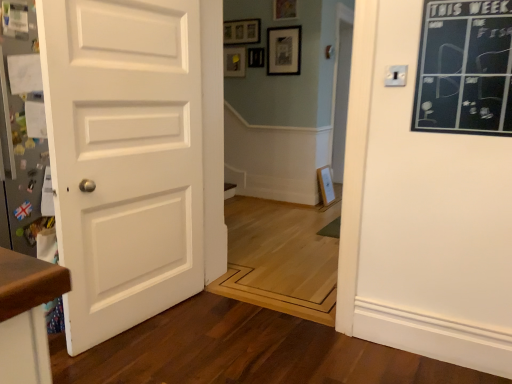
Question: In which direction should I rotate to look at matte black picture frame at upper center, which appears as the third picture frame when viewed from the top?

Choices:
 (A) right
 (B) left

Answer: (B)

Question: Is wooden picture frame at upper center, which is the 3th picture frame from bottom to top, to the right of white matte door at left from the viewer's perspective?

Choices:
 (A) yes
 (B) no

Answer: (A)

Question: From the image's perspective, is wooden picture frame at upper center, placed as the first picture frame when sorted from top to bottom, below white matte door at left?

Choices:
 (A) no
 (B) yes

Answer: (A)

Question: Is wooden picture frame at upper center, placed as the first picture frame when sorted from top to bottom, shorter than white matte door at left?

Choices:
 (A) no
 (B) yes

Answer: (B)

Question: Is wooden picture frame at upper center, placed as the first picture frame when sorted from top to bottom, next to white matte door at left and touching it?

Choices:
 (A) no
 (B) yes

Answer: (A)

Question: Is wooden picture frame at upper center, placed as the first picture frame when sorted from top to bottom, wider than white matte door at left?

Choices:
 (A) no
 (B) yes

Answer: (A)

Question: From a real-world perspective, does wooden picture frame at upper center, placed as the first picture frame when sorted from top to bottom, stand above white matte door at left?

Choices:
 (A) no
 (B) yes

Answer: (B)

Question: Considering the relative sizes of white matte door at left and black chalkboard at upper right in the image provided, is white matte door at left smaller than black chalkboard at upper right?

Choices:
 (A) no
 (B) yes

Answer: (A)

Question: Is white matte door at left bigger than black chalkboard at upper right?

Choices:
 (A) yes
 (B) no

Answer: (A)

Question: Is white matte door at left not close to black chalkboard at upper right?

Choices:
 (A) yes
 (B) no

Answer: (A)

Question: Considering the relative positions of white matte door at left and black chalkboard at upper right in the image provided, is white matte door at left behind black chalkboard at upper right?

Choices:
 (A) no
 (B) yes

Answer: (A)

Question: Would you say white matte door at left is outside black chalkboard at upper right?

Choices:
 (A) no
 (B) yes

Answer: (B)

Question: Considering the relative positions of white matte door at left and black chalkboard at upper right in the image provided, is white matte door at left to the right of black chalkboard at upper right from the viewer's perspective?

Choices:
 (A) no
 (B) yes

Answer: (A)

Question: From a real-world perspective, is black chalkboard at upper right physically above matte black picture frame at upper center, the 1th picture frame in the bottom-to-top sequence?

Choices:
 (A) no
 (B) yes

Answer: (A)